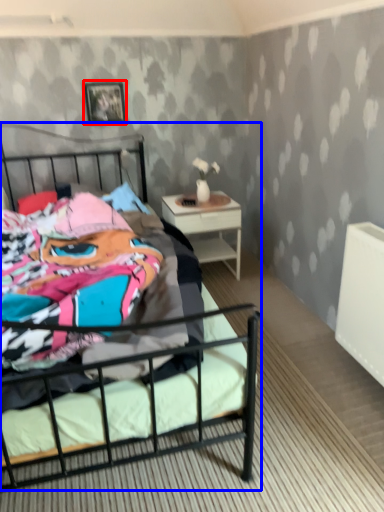
Question: Which object appears closest to the camera in this image, picture frame (highlighted by a red box) or bed (highlighted by a blue box)?

Choices:
 (A) picture frame
 (B) bed

Answer: (B)